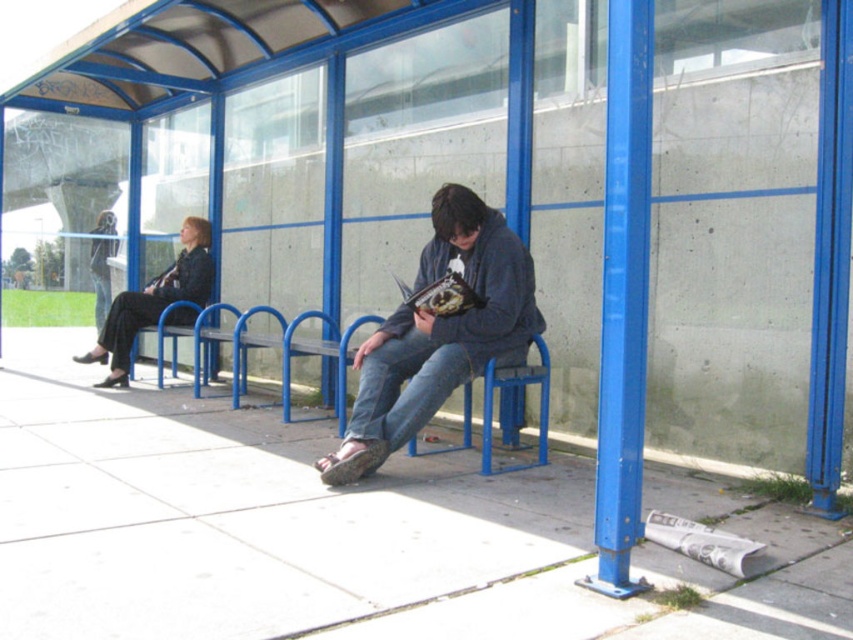
Who is higher up, denim jeans at center or dark blue jeans at center?

dark blue jeans at center is above.

Between denim jeans at center and dark blue jeans at center, which one appears on the left side from the viewer's perspective?

dark blue jeans at center is more to the left.

Between point (424, 260) and point (105, 221), which one is positioned behind?

The point (105, 221) is behind.

The image size is (853, 640). I want to click on denim jeans at center, so click(x=439, y=333).

Is black leather jacket at left bigger than dark blue jeans at center?

Indeed, black leather jacket at left has a larger size compared to dark blue jeans at center.

Is black leather jacket at left thinner than dark blue jeans at center?

In fact, black leather jacket at left might be wider than dark blue jeans at center.

Where is `black leather jacket at left`? The image size is (853, 640). black leather jacket at left is located at coordinates (154, 301).

Does black leather jacket at left have a greater height compared to blue metal bench at center?

Yes.

Who is shorter, black leather jacket at left or blue metal bench at center?

blue metal bench at center is shorter.

Which is in front, point (184, 324) or point (221, 339)?

Positioned in front is point (221, 339).

Where is `black leather jacket at left`? The image size is (853, 640). black leather jacket at left is located at coordinates (154, 301).